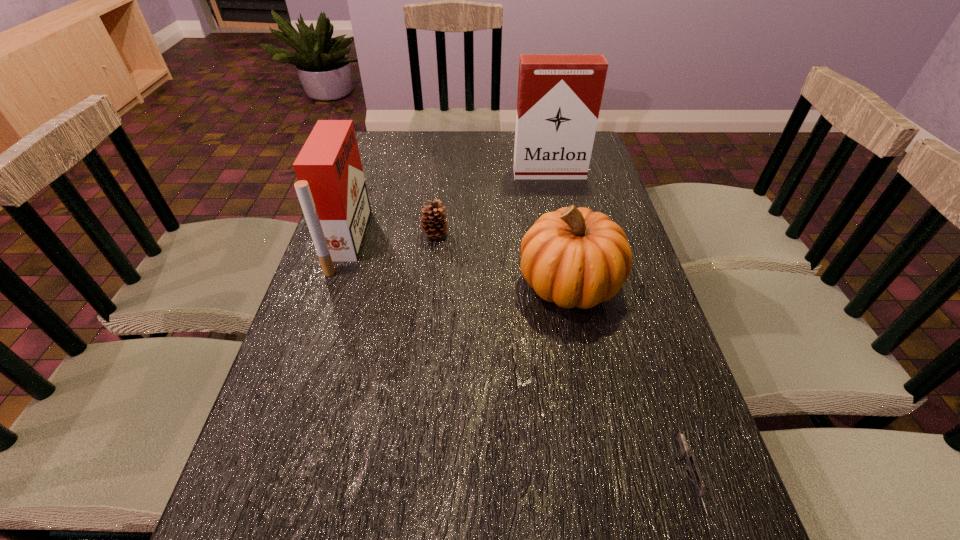
You are a GUI agent. You are given a task and a screenshot of the screen. Output one action in this format:
    pyautogui.click(x=<x>, y=<y>)
    Task: Click on the right cigarette case
    The height and width of the screenshot is (540, 960).
    Given the screenshot: What is the action you would take?
    pyautogui.click(x=559, y=96)

Identify the location of the taller cigarette case. Image resolution: width=960 pixels, height=540 pixels. (559, 96).

Locate an element on the screen. Image resolution: width=960 pixels, height=540 pixels. the shorter cigarette case is located at coordinates (331, 188).

This screenshot has width=960, height=540. Identify the location of the nearer cigarette case. click(331, 188).

I want to click on the third shortest object, so click(x=575, y=257).

Find the location of a particular element. This screenshot has width=960, height=540. the second shortest object is located at coordinates (432, 222).

The image size is (960, 540). Find the location of `the second object from left to right`. the second object from left to right is located at coordinates point(432,222).

The height and width of the screenshot is (540, 960). I want to click on gun, so click(692, 466).

Locate an element on the screen. The image size is (960, 540). the shortest object is located at coordinates (692, 466).

Where is `free space located on the front-facing side of the taller cigarette case`? The image size is (960, 540). free space located on the front-facing side of the taller cigarette case is located at coordinates (556, 203).